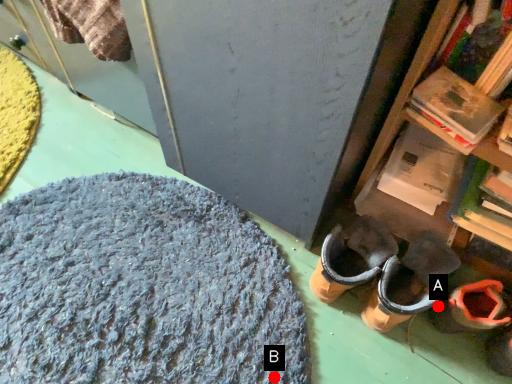
Question: Two points are circled on the image, labeled by A and B beside each circle. Which point is farther to the camera?

Choices:
 (A) A is further
 (B) B is further

Answer: (A)